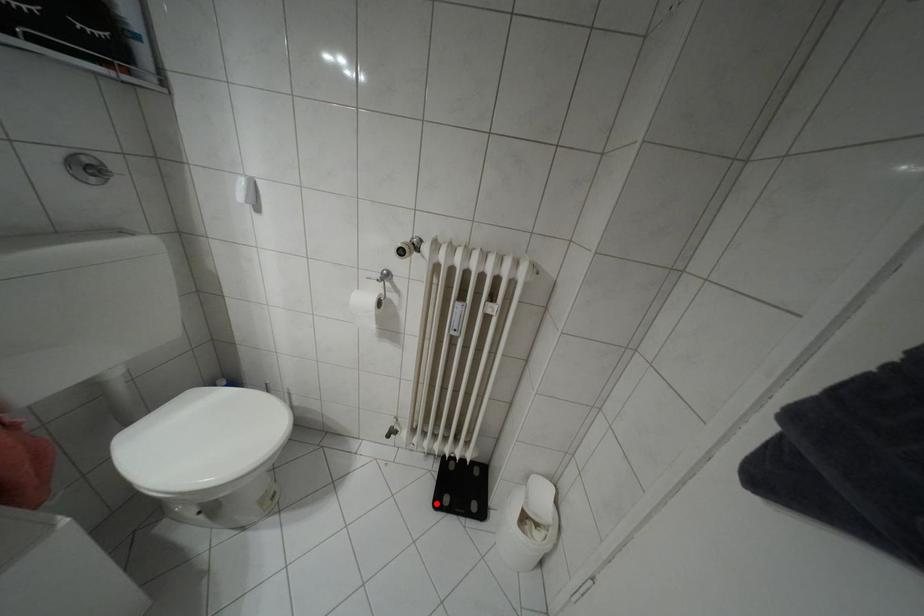
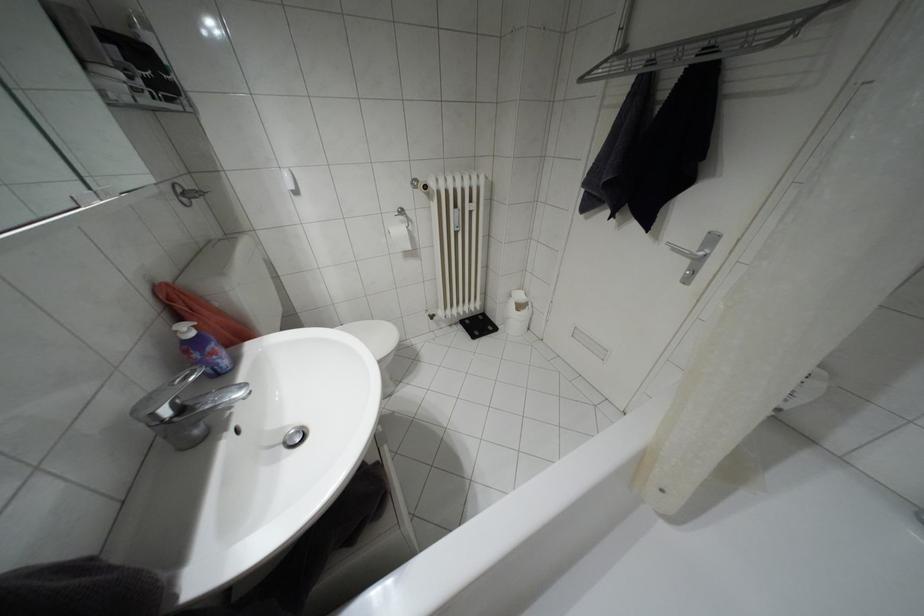
Question: I am providing you with two images of the same scene from different viewpoints. Image1 has a red point marked. In image2, the corresponding 3D location appears at what relative position? Reply with the corresponding letter.

Choices:
 (A) Closer
 (B) Farther

Answer: (A)